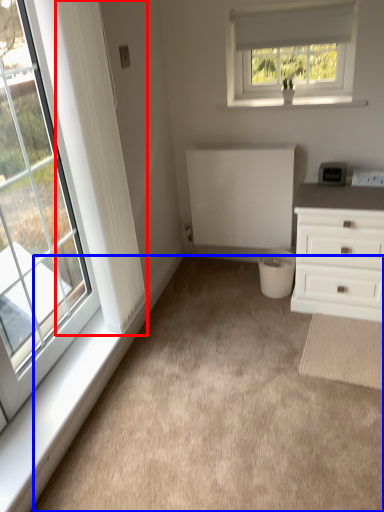
Question: Which object is closer to the camera taking this photo, curtain (highlighted by a red box) or plain (highlighted by a blue box)?

Choices:
 (A) curtain
 (B) plain

Answer: (B)